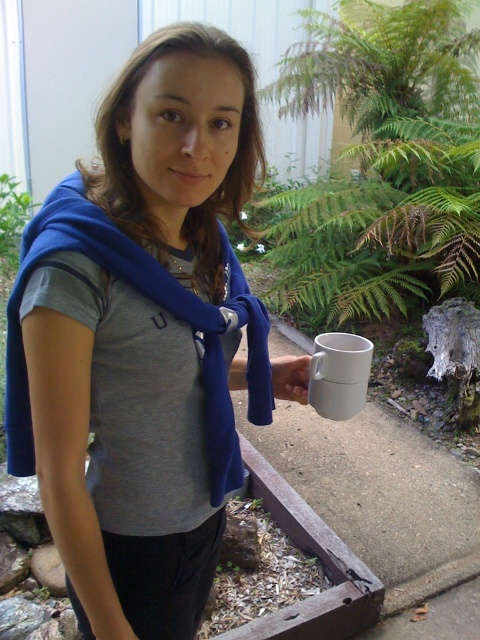
You are a barista trying to serve a customer who prefers larger drinks. You have a white matte mug at lower right and a white matte cup at center. Which one should you choose?

You should choose the white matte mug at lower right because it is bigger than the white matte cup at center, making it suitable for larger drinks.

You are setting up a table for a tea ceremony. You have a white matte mug at lower right and a white matte cup at center. Which one should you choose if you need a larger vessel for a hot beverage?

The white matte mug at lower right should be chosen because its width is larger than the white matte cup at center, making it more suitable for holding a larger volume of hot beverage.

You are a photographer trying to capture the person holding the white matte mug at lower right. To get a clear shot of the mug, do you need to adjust your angle to avoid the blue fabric scarf at upper left blocking the view?

Yes, the blue fabric scarf at upper left is in front of the white matte mug at lower right, so adjusting your angle will help avoid the scarf blocking the view of the mug.